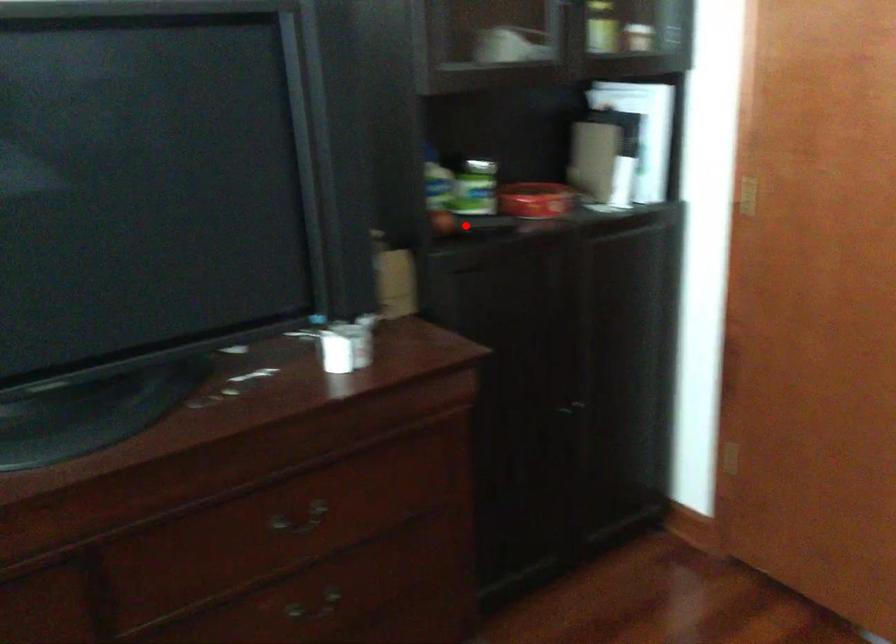
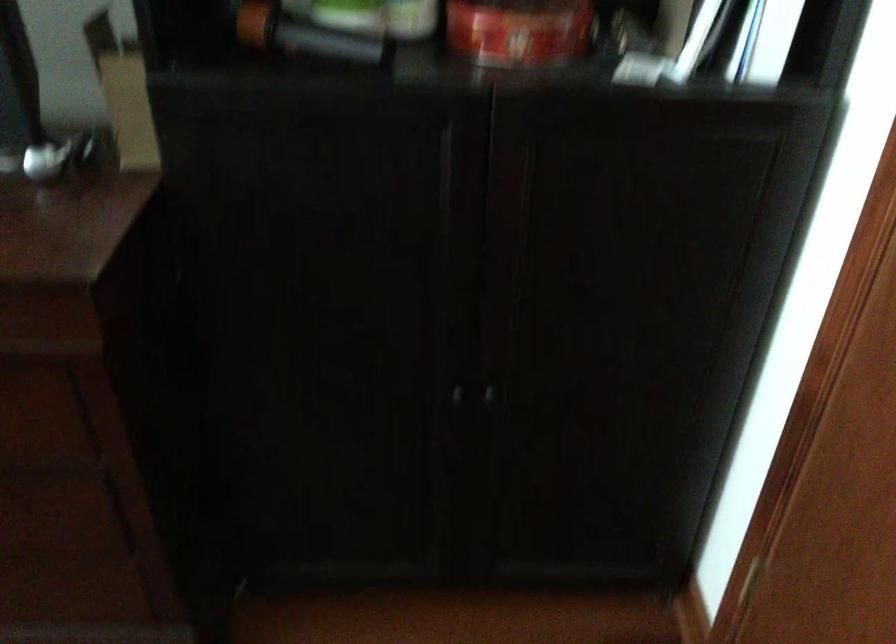
Locate, in the second image, the point that corresponds to the highlighted location in the first image.

(304, 35)